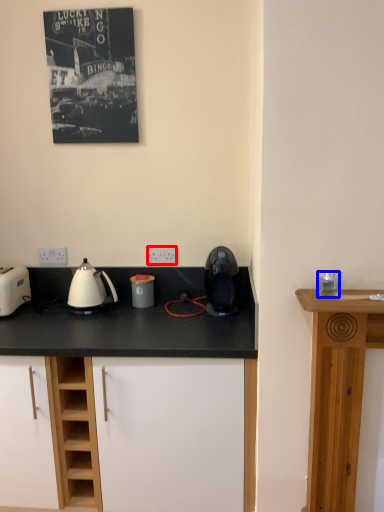
Question: Among these objects, which one is nearest to the camera, electric outlet (highlighted by a red box) or appliance (highlighted by a blue box)?

Choices:
 (A) electric outlet
 (B) appliance

Answer: (B)